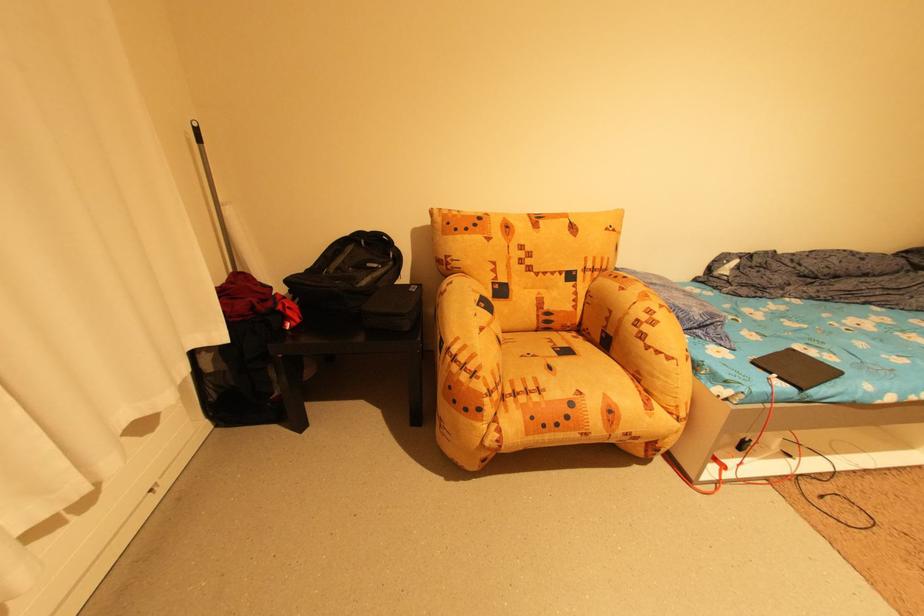
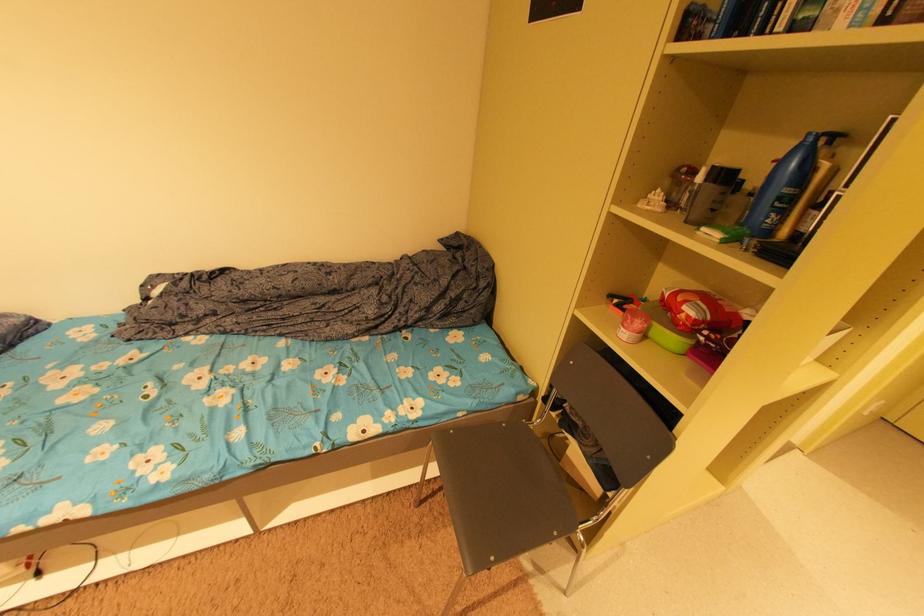
Question: The images are taken continuously from a first-person perspective. In which direction are you moving?

Choices:
 (A) Left
 (B) Right
 (C) Forward
 (D) Backward

Answer: (B)